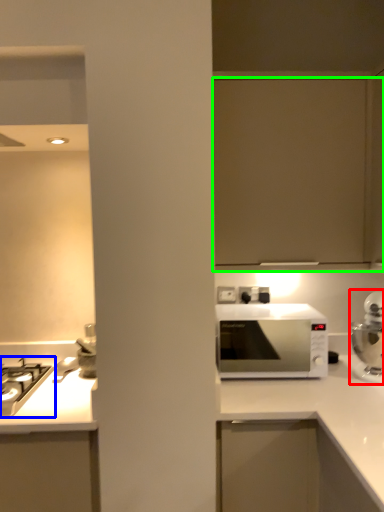
Question: Which object is the closest to the home appliance (highlighted by a red box)? Choose among these: gas stove (highlighted by a blue box) or cabinetry (highlighted by a green box).

Choices:
 (A) gas stove
 (B) cabinetry

Answer: (B)